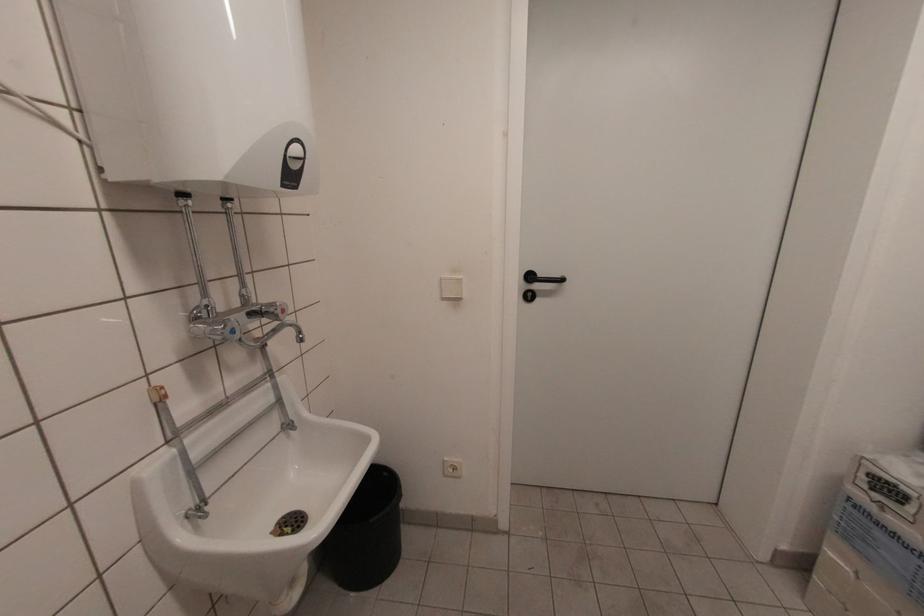
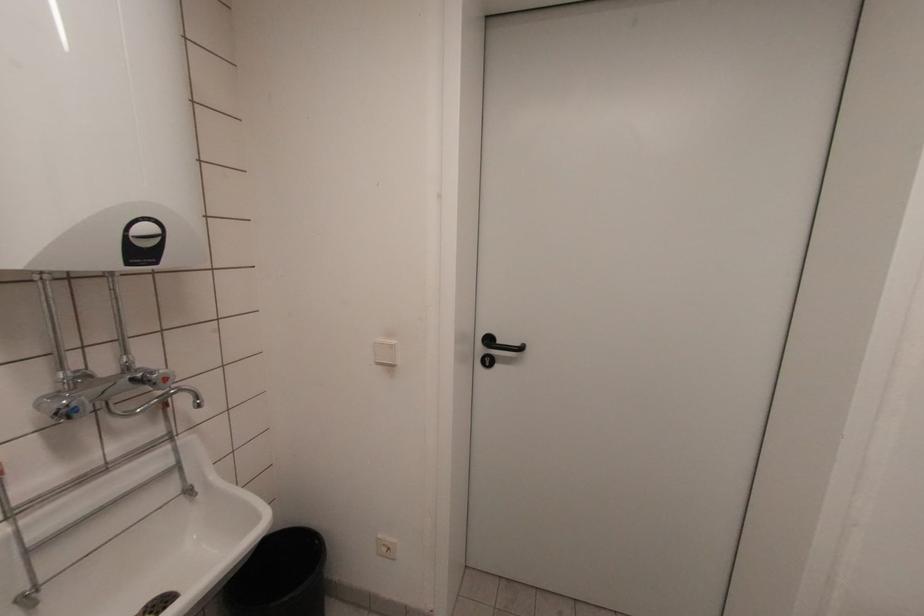
Find the pixel in the second image that matches point (530, 299) in the first image.

(488, 363)